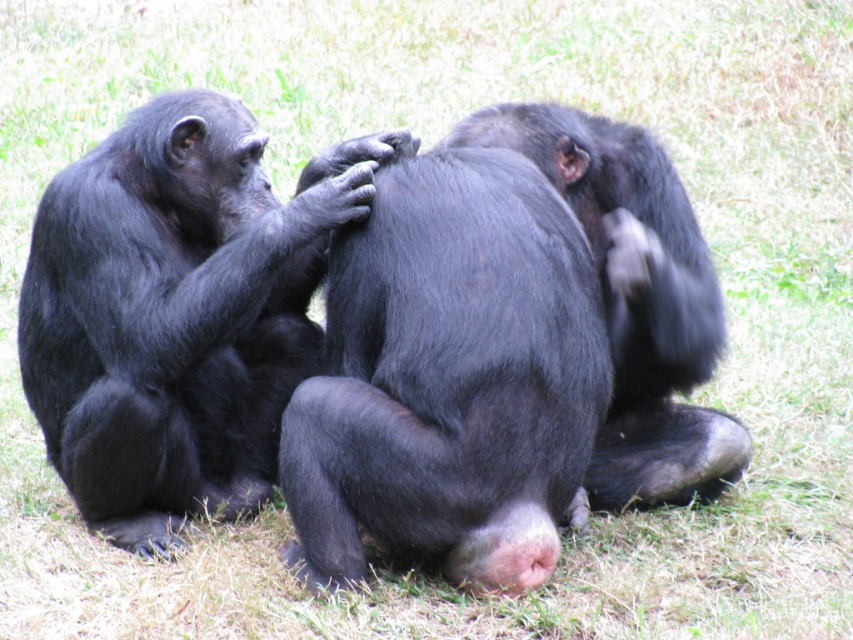
You are a zookeeper observing the chimpanzees in their enclosure. You notice a specific point at coordinates point (177, 310). Which chimpanzee is this point located on?

The point (177, 310) is located on the shiny black monkey at center.